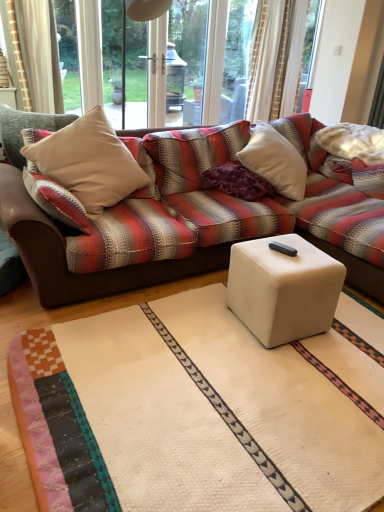
Question: Are beige fabric pillow at left and white matte cube at center far apart?

Choices:
 (A) yes
 (B) no

Answer: (A)

Question: Is beige fabric pillow at left oriented away from white matte cube at center?

Choices:
 (A) no
 (B) yes

Answer: (A)

Question: Considering the relative sizes of beige fabric pillow at left and white matte cube at center in the image provided, is beige fabric pillow at left thinner than white matte cube at center?

Choices:
 (A) yes
 (B) no

Answer: (B)

Question: Is beige fabric pillow at left oriented towards white matte cube at center?

Choices:
 (A) yes
 (B) no

Answer: (A)

Question: Can you confirm if beige fabric pillow at left is positioned to the right of white matte cube at center?

Choices:
 (A) no
 (B) yes

Answer: (A)

Question: In terms of height, does white matte cube at center look taller or shorter compared to purple velvet pillow at center?

Choices:
 (A) tall
 (B) short

Answer: (A)

Question: In the image, is white matte cube at center on the left side or the right side of purple velvet pillow at center?

Choices:
 (A) right
 (B) left

Answer: (A)

Question: From the image's perspective, is white matte cube at center positioned above or below purple velvet pillow at center?

Choices:
 (A) below
 (B) above

Answer: (A)

Question: In the image, is white matte cube at center positioned in front of or behind purple velvet pillow at center?

Choices:
 (A) front
 (B) behind

Answer: (A)

Question: Considering the positions of point (178, 90) and point (251, 181), is point (178, 90) closer or farther from the camera than point (251, 181)?

Choices:
 (A) closer
 (B) farther

Answer: (B)

Question: From a real-world perspective, is transparent glass screen door at upper center above or below purple velvet pillow at center?

Choices:
 (A) above
 (B) below

Answer: (A)

Question: In terms of width, does transparent glass screen door at upper center look wider or thinner when compared to purple velvet pillow at center?

Choices:
 (A) thin
 (B) wide

Answer: (B)

Question: Based on their positions, is transparent glass screen door at upper center located to the left or right of purple velvet pillow at center?

Choices:
 (A) right
 (B) left

Answer: (B)

Question: Based on their sizes in the image, would you say beige fabric pillow at left is bigger or smaller than transparent glass screen door at upper center?

Choices:
 (A) big
 (B) small

Answer: (A)

Question: From a real-world perspective, relative to transparent glass screen door at upper center, is beige fabric pillow at left vertically above or below?

Choices:
 (A) below
 (B) above

Answer: (A)